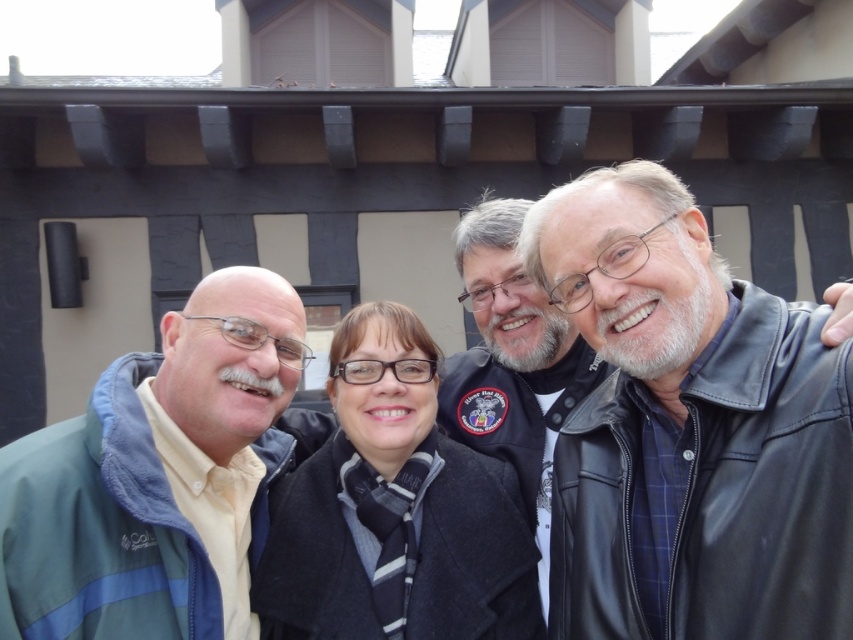
Which is behind, point (618, 496) or point (297, 545)?

The point (297, 545) is more distant.

Is leather jacket at right thinner than dark gray wool coat at center?

Yes, leather jacket at right is thinner than dark gray wool coat at center.

Is point (656, 618) farther from camera compared to point (476, 545)?

No.

The height and width of the screenshot is (640, 853). I want to click on leather jacket at right, so click(x=689, y=429).

Describe the element at coordinates (395, 513) in the screenshot. The width and height of the screenshot is (853, 640). I see `dark gray wool coat at center` at that location.

Find the location of a particular element. The height and width of the screenshot is (640, 853). dark gray wool coat at center is located at coordinates (395, 513).

Between point (776, 484) and point (120, 525), which one is positioned in front?

Positioned in front is point (776, 484).

Is leather jacket at right further to the viewer compared to green fleece jacket at left?

No, leather jacket at right is closer to the viewer.

Where is `leather jacket at right`? The width and height of the screenshot is (853, 640). leather jacket at right is located at coordinates (689, 429).